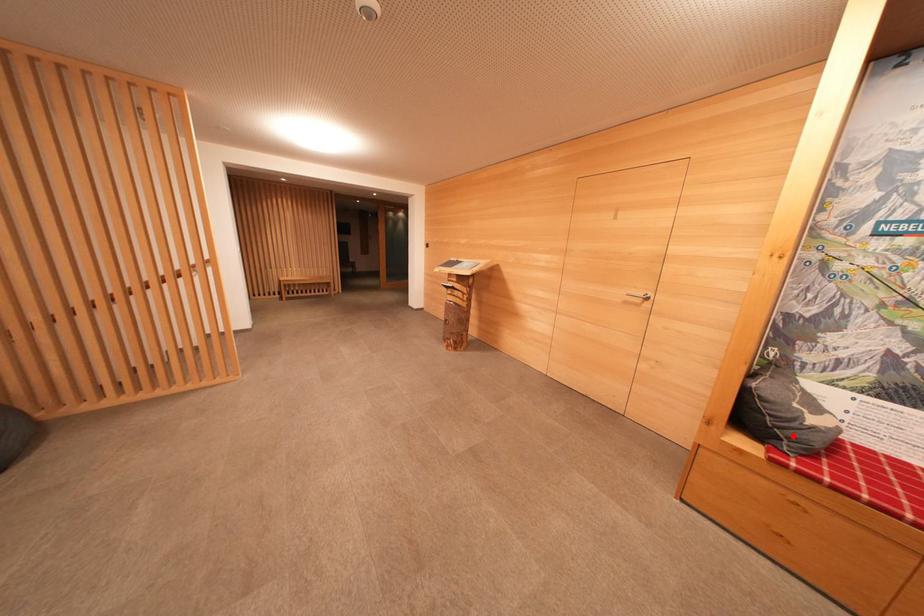
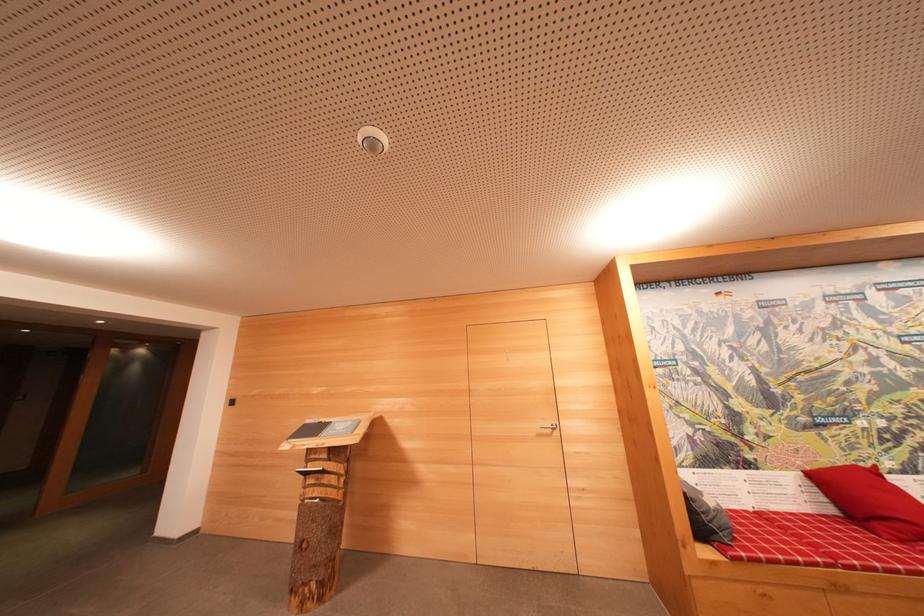
Question: A red point is marked in image1. In image2, is the corresponding 3D point closer to the camera or farther? Reply with the corresponding letter.

Choices:
 (A) The corresponding 3D point is closer.
 (B) The corresponding 3D point is farther.

Answer: (A)